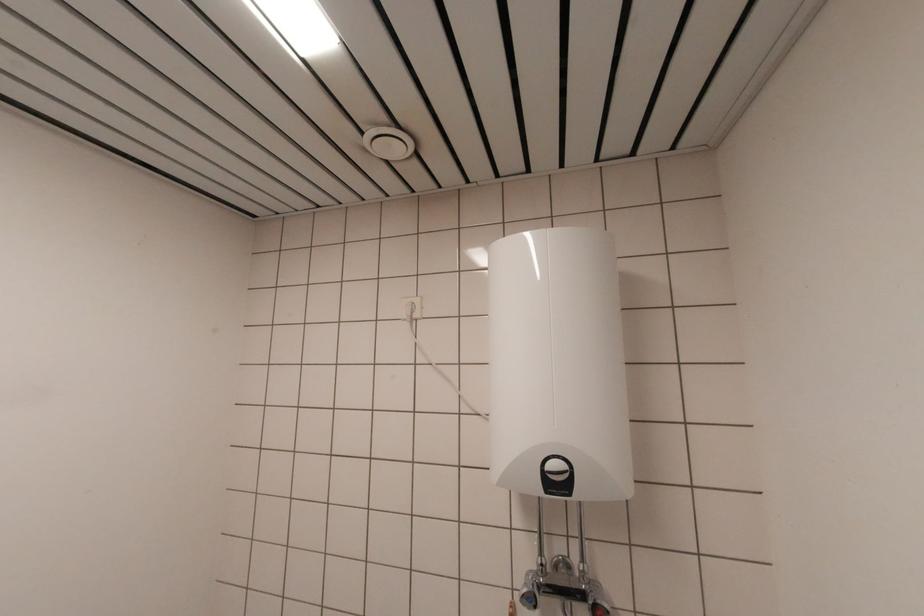
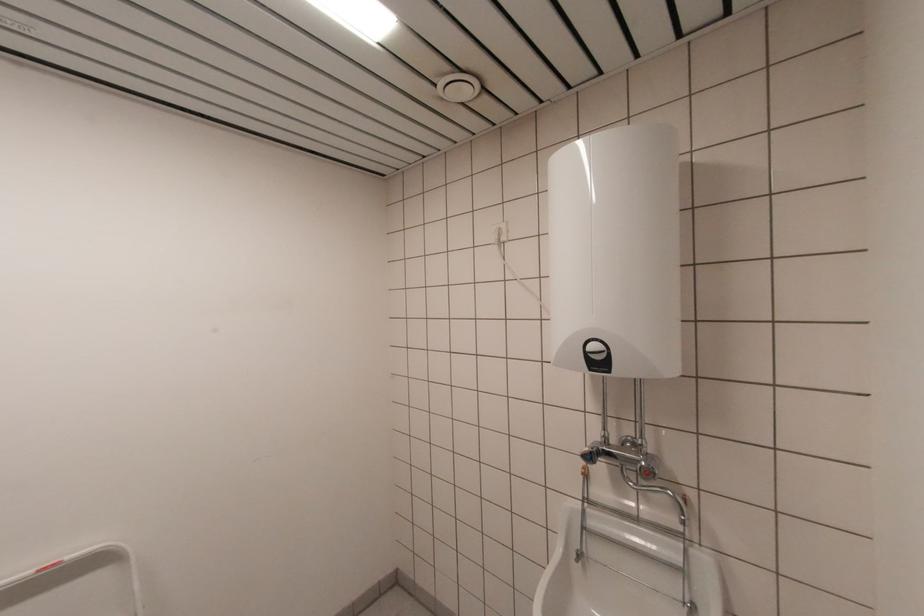
The point at (412,315) is marked in the first image. Where is the corresponding point in the second image?

(501, 240)